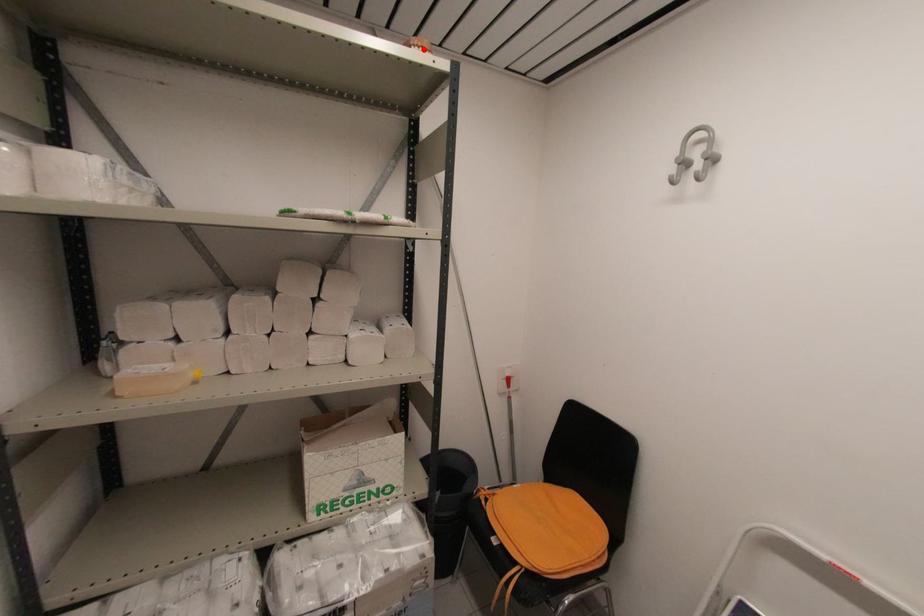
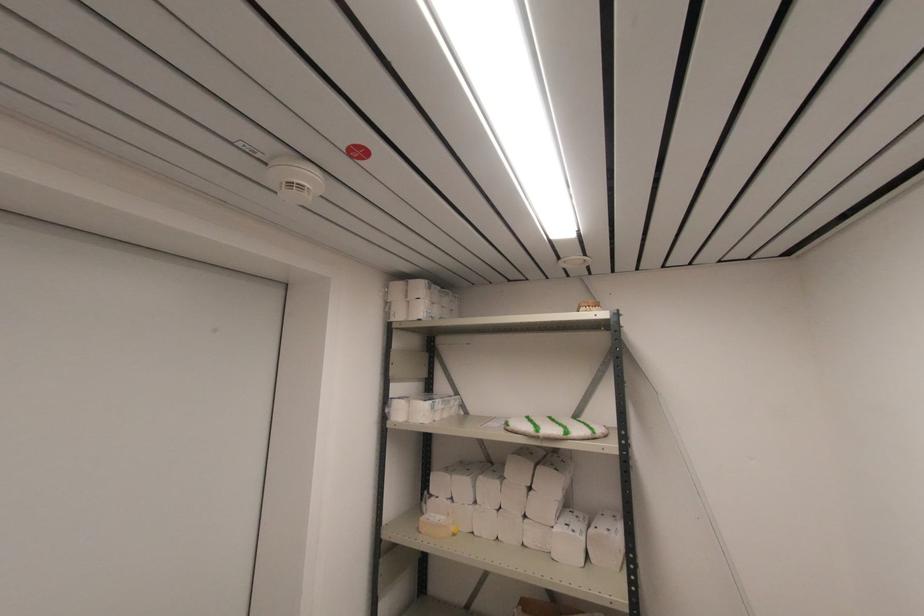
Where in the second image is the point corresponding to the highlighted location from the first image?

(590, 307)